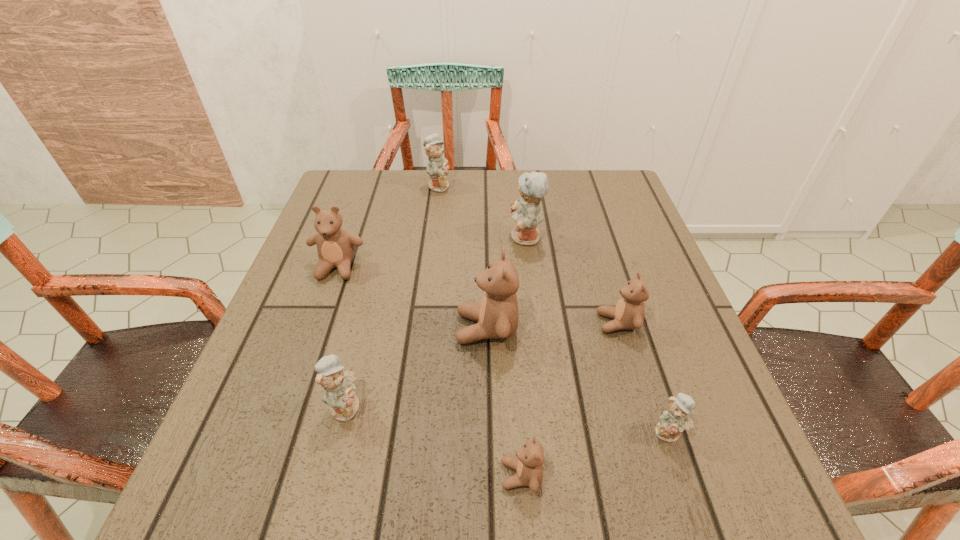
In order to click on the rightmost blue teddy bear in this screenshot , I will do `click(675, 420)`.

Find the location of `the nearest object`. the nearest object is located at coordinates (528, 464).

Identify the location of the nearest teddy bear. (528, 464).

This screenshot has height=540, width=960. I want to click on free space located on the front-facing side of the second blue teddy bear from right to left, so click(390, 238).

Where is `free location located on the front-facing side of the second blue teddy bear from right to left`? Image resolution: width=960 pixels, height=540 pixels. free location located on the front-facing side of the second blue teddy bear from right to left is located at coordinates (394, 238).

Locate an element on the screen. vacant region located 0.390m on the front-facing side of the second blue teddy bear from right to left is located at coordinates (348, 238).

At what (x,y) coordinates should I click in order to perform the action: click on blank space located on the front-facing side of the biggest brown teddy bear. Please return your answer as a coordinate pair (x, y). The image size is (960, 540). Looking at the image, I should click on [x=359, y=328].

Where is `vacant space located on the front-facing side of the biggest brown teddy bear`? This screenshot has height=540, width=960. vacant space located on the front-facing side of the biggest brown teddy bear is located at coordinates (282, 328).

Image resolution: width=960 pixels, height=540 pixels. In order to click on blank space located on the front-facing side of the biggest brown teddy bear in this screenshot , I will do `click(319, 328)`.

You are a GUI agent. You are given a task and a screenshot of the screen. Output one action in this format:
    pyautogui.click(x=<x>, y=<y>)
    Task: Click on the vacant area situated on the front-facing side of the third teddy bear from left to right
    The height and width of the screenshot is (540, 960).
    Given the screenshot: What is the action you would take?
    pyautogui.click(x=472, y=185)